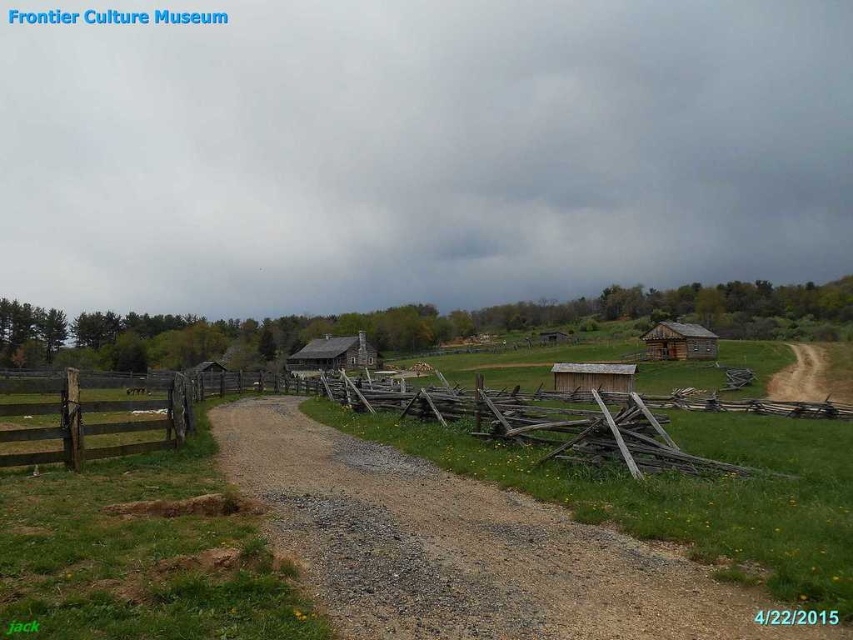
You are standing at the starting point of the gravel path in the rural landscape scene. You notice two points marked on the image, point 1 at coordinates point (701, 632) and point 2 at coordinates point (682, 342). Which point is closer to you?

Point (701, 632) is closer to the viewer than point (682, 342).